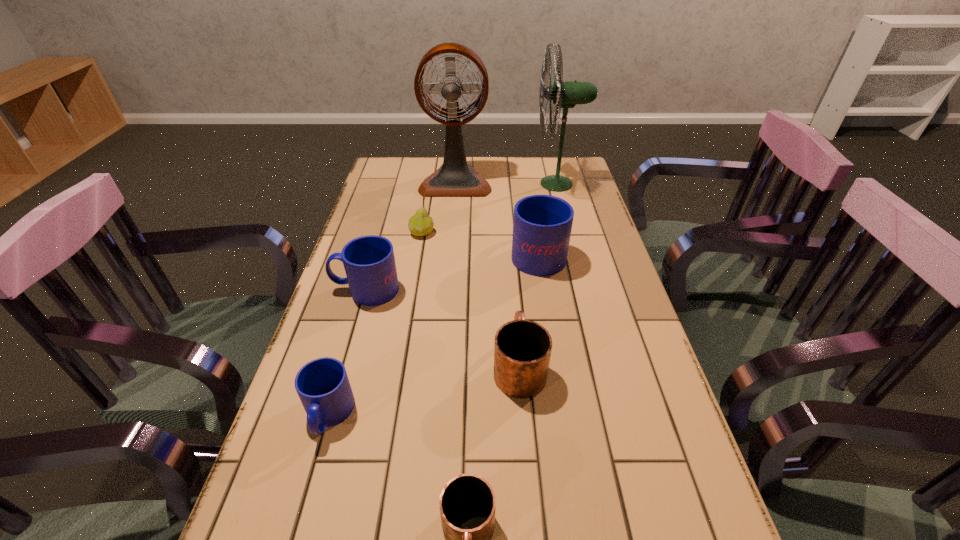
Find the location of a particular element. The width and height of the screenshot is (960, 540). free space that satisfies the following two spatial constraints: 1. on the front-facing side of the green fan; 2. on the side with the handle of the smallest blue mug is located at coordinates (619, 415).

Image resolution: width=960 pixels, height=540 pixels. Find the location of `free space that satisfies the following two spatial constraints: 1. on the side of the farther rust mug with the handle; 2. on the side with the handle of the second smallest blue mug`. free space that satisfies the following two spatial constraints: 1. on the side of the farther rust mug with the handle; 2. on the side with the handle of the second smallest blue mug is located at coordinates (513, 289).